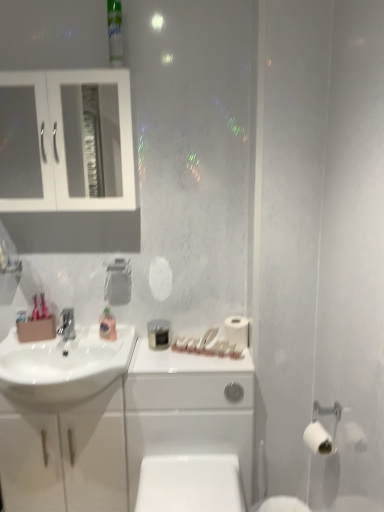
Question: Is white glossy toilet bowl at lower center oriented towards white matte toilet paper at right, acting as the first toilet paper starting from the back?

Choices:
 (A) no
 (B) yes

Answer: (A)

Question: Does white glossy toilet bowl at lower center have a greater height compared to white matte toilet paper at right, arranged as the 1th toilet paper when viewed from the top?

Choices:
 (A) no
 (B) yes

Answer: (B)

Question: Does white glossy toilet bowl at lower center have a smaller size compared to white matte toilet paper at right, arranged as the 1th toilet paper when viewed from the top?

Choices:
 (A) no
 (B) yes

Answer: (A)

Question: Does white glossy toilet bowl at lower center have a larger size compared to white matte toilet paper at right, marked as the 1th toilet paper in a left-to-right arrangement?

Choices:
 (A) no
 (B) yes

Answer: (B)

Question: Is white glossy toilet bowl at lower center facing away from white matte toilet paper at right, arranged as the 1th toilet paper when viewed from the top?

Choices:
 (A) yes
 (B) no

Answer: (B)

Question: From their relative heights in the image, would you say matte silver faucet at sink left is taller or shorter than white glass cabinet at upper left?

Choices:
 (A) short
 (B) tall

Answer: (A)

Question: Relative to white glass cabinet at upper left, is matte silver faucet at sink left in front or behind?

Choices:
 (A) front
 (B) behind

Answer: (B)

Question: Is matte silver faucet at sink left bigger or smaller than white glass cabinet at upper left?

Choices:
 (A) big
 (B) small

Answer: (B)

Question: From the image's perspective, relative to white glass cabinet at upper left, is matte silver faucet at sink left above or below?

Choices:
 (A) below
 (B) above

Answer: (A)

Question: Is white glossy sink at left situated inside green plastic mouthwash at upper center, the second mouthwash in the bottom-to-top sequence, or outside?

Choices:
 (A) outside
 (B) inside

Answer: (A)

Question: Would you say white glossy sink at left is to the left or to the right of green plastic mouthwash at upper center, the second mouthwash in the bottom-to-top sequence, in the picture?

Choices:
 (A) left
 (B) right

Answer: (A)

Question: Considering the positions of white glossy sink at left and green plastic mouthwash at upper center, the 2th mouthwash from the back, in the image, is white glossy sink at left bigger or smaller than green plastic mouthwash at upper center, the 2th mouthwash from the back,?

Choices:
 (A) small
 (B) big

Answer: (B)

Question: Is white glossy sink at left taller or shorter than green plastic mouthwash at upper center, the 2th mouthwash from the back?

Choices:
 (A) tall
 (B) short

Answer: (B)

Question: Choose the correct answer: Is white matte toilet paper at right, which ranks as the 2th toilet paper in bottom-to-top order, inside matte silver faucet at sink left or outside it?

Choices:
 (A) outside
 (B) inside

Answer: (A)

Question: Does point (235, 326) appear closer or farther from the camera than point (61, 328)?

Choices:
 (A) closer
 (B) farther

Answer: (A)